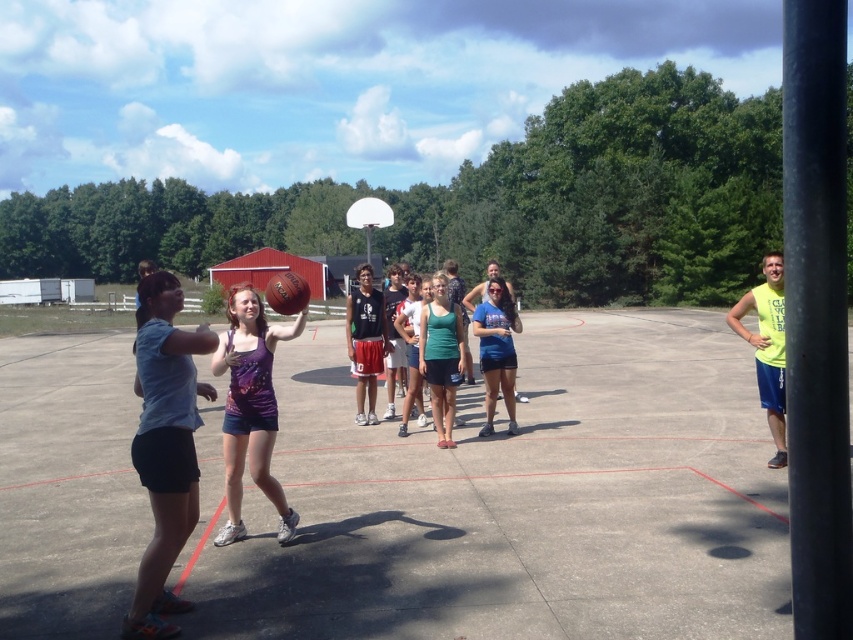
Question: Among these objects, which one is farthest from the camera?

Choices:
 (A) rubberized concrete basketball court at center
 (B) blue denim shorts at center

Answer: (B)

Question: Does light blue cotton shirt at left appear under rubber textured basketball at center?

Choices:
 (A) no
 (B) yes

Answer: (B)

Question: Which object appears closest to the camera in this image?

Choices:
 (A) rubberized concrete basketball court at center
 (B) rubber textured basketball at center
 (C) purple matte tank top at center
 (D) blue denim shorts at center

Answer: (A)

Question: Is blue denim shorts at center wider than white glossy basketball hoop at center?

Choices:
 (A) no
 (B) yes

Answer: (A)

Question: Can you confirm if light blue cotton shirt at left is positioned below white glossy basketball hoop at center?

Choices:
 (A) no
 (B) yes

Answer: (B)

Question: Which object is closer to the camera taking this photo?

Choices:
 (A) green cotton tank top at center
 (B) light blue cotton shirt at left
 (C) matte green tank top at center

Answer: (B)